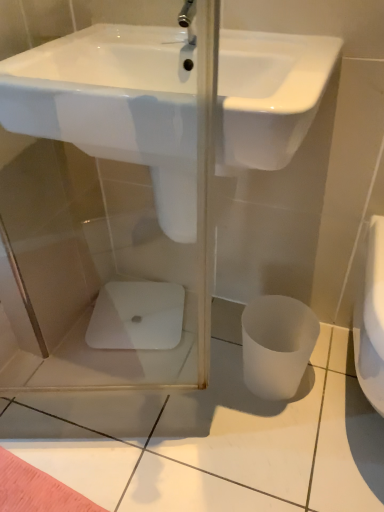
Identify the location of white glossy porcelain at center. The image size is (384, 512). (137, 316).

Locate an element on the screen. white glossy sink at upper center is located at coordinates tap(115, 106).

From the image's perspective, would you say white matte toilet bowl at lower right is shown under white glossy porcelain at center?

Indeed, from the image's perspective, white matte toilet bowl at lower right is shown beneath white glossy porcelain at center.

Can you confirm if white matte toilet bowl at lower right is taller than white glossy porcelain at center?

Yes.

Is white matte toilet bowl at lower right facing towards white glossy porcelain at center?

No, white matte toilet bowl at lower right is not facing towards white glossy porcelain at center.

Which is correct: white matte toilet bowl at lower right is inside white glossy porcelain at center, or outside of it?

white matte toilet bowl at lower right is not inside white glossy porcelain at center, it's outside.

Considering the points (191, 189) and (121, 330), which point is in front, point (191, 189) or point (121, 330)?

The point (191, 189) is closer.

Would you say white glossy sink at upper center is to the left or to the right of white glossy porcelain at center in the picture?

In the image, white glossy sink at upper center appears on the right side of white glossy porcelain at center.

Is white glossy sink at upper center spatially inside white glossy porcelain at center, or outside of it?

white glossy sink at upper center exists outside the volume of white glossy porcelain at center.

Is white glossy sink at upper center thinner than white glossy porcelain at center?

No, white glossy sink at upper center is not thinner than white glossy porcelain at center.

Could you tell me if white matte toilet bowl at lower right is facing white glossy sink at upper center?

No, white matte toilet bowl at lower right is not facing towards white glossy sink at upper center.

Considering the sizes of white matte toilet bowl at lower right and white glossy sink at upper center in the image, is white matte toilet bowl at lower right bigger or smaller than white glossy sink at upper center?

In the image, white matte toilet bowl at lower right appears to be smaller than white glossy sink at upper center.

From the image's perspective, between white matte toilet bowl at lower right and white glossy sink at upper center, who is located below?

white matte toilet bowl at lower right, from the image's perspective.

Does white glossy sink at upper center have a greater width compared to white matte toilet bowl at lower right?

Yes.

Is white glossy sink at upper center located outside white matte toilet bowl at lower right?

That's correct, white glossy sink at upper center is outside of white matte toilet bowl at lower right.

Is white glossy sink at upper center oriented towards white matte toilet bowl at lower right?

No, white glossy sink at upper center is not turned towards white matte toilet bowl at lower right.

Considering the sizes of objects white glossy sink at upper center and white matte toilet bowl at lower right in the image provided, who is bigger, white glossy sink at upper center or white matte toilet bowl at lower right?

With larger size is white glossy sink at upper center.

Between white glossy porcelain at center and white matte toilet bowl at lower right, which one has larger width?

With larger width is white glossy porcelain at center.

This screenshot has width=384, height=512. Identify the location of toilet bowl below the white glossy porcelain at center (from the image's perspective). (277, 345).

From a real-world perspective, is white glossy porcelain at center under white matte toilet bowl at lower right?

Yes, from a real-world perspective, white glossy porcelain at center is under white matte toilet bowl at lower right.

Is point (123, 322) closer or farther from the camera than point (268, 325)?

Point (123, 322) is positioned farther from the camera compared to point (268, 325).

Is white glossy porcelain at center positioned in front of white glossy sink at upper center?

No, white glossy porcelain at center is further to the viewer.

From the image's perspective, is white glossy porcelain at center on top of white glossy sink at upper center?

Incorrect, from the image's perspective, white glossy porcelain at center is lower than white glossy sink at upper center.

Consider the image. In terms of width, does white glossy porcelain at center look wider or thinner when compared to white glossy sink at upper center?

Considering their sizes, white glossy porcelain at center looks slimmer than white glossy sink at upper center.

The height and width of the screenshot is (512, 384). What are the coordinates of `toilet bowl below the white glossy porcelain at center (from the image's perspective)` in the screenshot? It's located at (277, 345).

This screenshot has width=384, height=512. In order to click on sink that is above the white glossy porcelain at center (from the image's perspective) in this screenshot , I will do `click(115, 106)`.

Considering their positions, is white matte toilet bowl at lower right positioned further to white glossy sink at upper center than white glossy porcelain at center?

white glossy porcelain at center.

From the picture: When comparing their distances from white matte toilet bowl at lower right, does white glossy sink at upper center or white glossy porcelain at center seem further?

Based on the image, white glossy sink at upper center appears to be further to white matte toilet bowl at lower right.

Based on their spatial positions, is white glossy sink at upper center or white matte toilet bowl at lower right further from white glossy porcelain at center?

The object further to white glossy porcelain at center is white glossy sink at upper center.

When comparing their distances from white glossy porcelain at center, does white matte toilet bowl at lower right or white glossy sink at upper center seem further?

white glossy sink at upper center lies further to white glossy porcelain at center than the other object.

Based on their spatial positions, is white glossy porcelain at center or white matte toilet bowl at lower right closer to white glossy sink at upper center?

white matte toilet bowl at lower right is positioned closer to the anchor white glossy sink at upper center.

Estimate the real-world distances between objects in this image. Which object is further from white matte toilet bowl at lower right, white glossy porcelain at center or white glossy sink at upper center?

white glossy sink at upper center is further to white matte toilet bowl at lower right.

Locate an element on the screen. toilet bowl positioned between white glossy sink at upper center and white glossy porcelain at center from near to far is located at coordinates (277, 345).